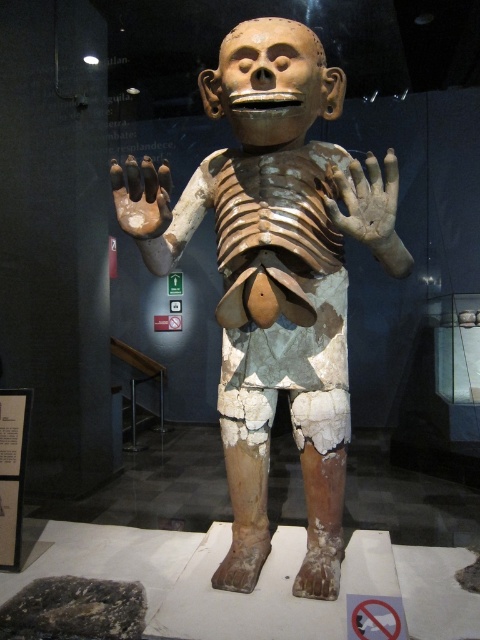
Question: Among these points, which one is farthest from the camera?

Choices:
 (A) (156, 208)
 (B) (376, 186)
 (C) (189, 196)

Answer: (C)

Question: Among these objects, which one is farthest from the camera?

Choices:
 (A) matte clay hand at center
 (B) matte clay skeleton at center
 (C) brown matte hand at center

Answer: (B)

Question: Can you confirm if matte clay skeleton at center is bigger than brown matte hand at center?

Choices:
 (A) no
 (B) yes

Answer: (B)

Question: Considering the relative positions of matte clay skeleton at center and matte clay hand at center in the image provided, where is matte clay skeleton at center located with respect to matte clay hand at center?

Choices:
 (A) left
 (B) right

Answer: (A)

Question: Observing the image, what is the correct spatial positioning of matte clay skeleton at center in reference to brown matte hand at center?

Choices:
 (A) right
 (B) left

Answer: (A)

Question: Estimate the real-world distances between objects in this image. Which object is closer to the brown matte hand at center?

Choices:
 (A) matte clay skeleton at center
 (B) matte clay hand at center

Answer: (B)